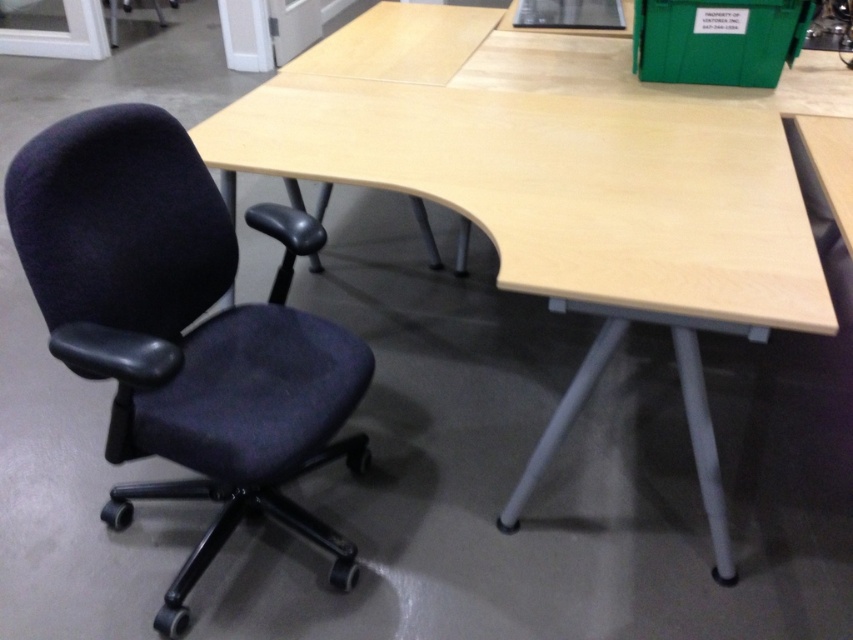
Question: Is light wood/wooden table at center to the right of dark blue fabric swivel chair at left from the viewer's perspective?

Choices:
 (A) yes
 (B) no

Answer: (A)

Question: Which of the following is the farthest from the observer?

Choices:
 (A) (289, 344)
 (B) (790, 168)

Answer: (B)

Question: Which point is farther to the camera?

Choices:
 (A) (424, 115)
 (B) (308, 404)

Answer: (A)

Question: Which object is farther from the camera taking this photo?

Choices:
 (A) light wood/wooden table at center
 (B) dark blue fabric swivel chair at left

Answer: (A)

Question: Is light wood/wooden table at center to the left of dark blue fabric swivel chair at left from the viewer's perspective?

Choices:
 (A) no
 (B) yes

Answer: (A)

Question: Observing the image, what is the correct spatial positioning of light wood/wooden table at center in reference to dark blue fabric swivel chair at left?

Choices:
 (A) left
 (B) right

Answer: (B)